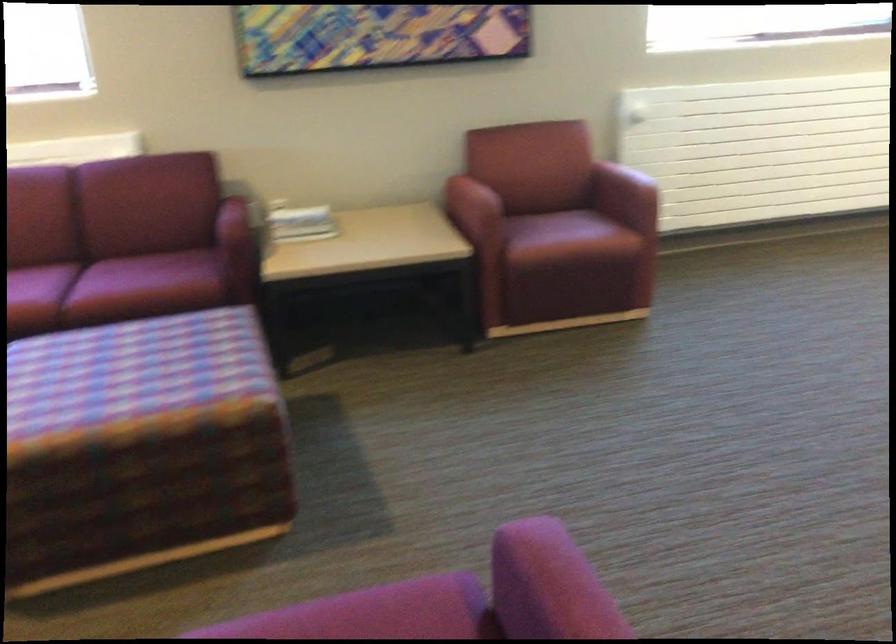
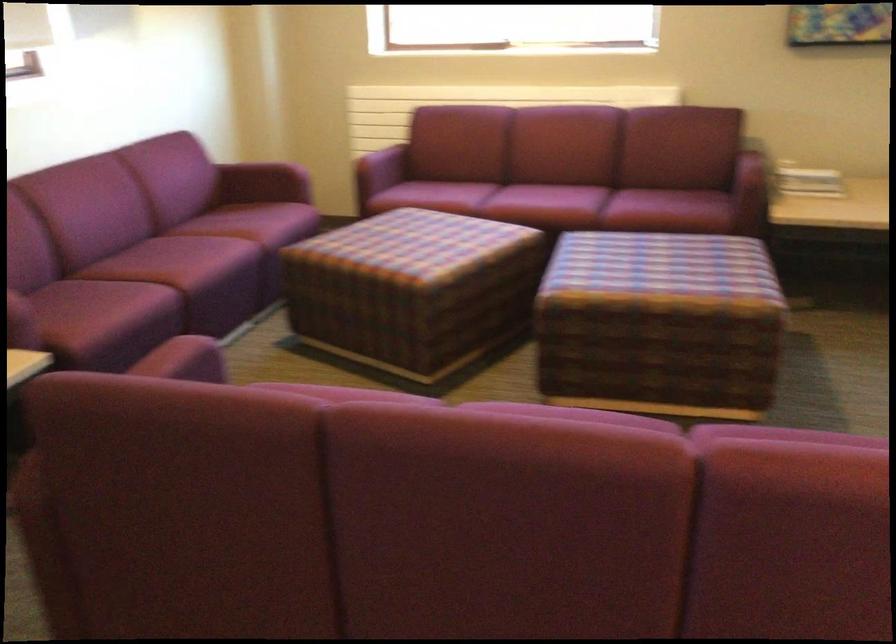
Find the pixel in the second image that matches (x=151, y=290) in the first image.

(668, 211)